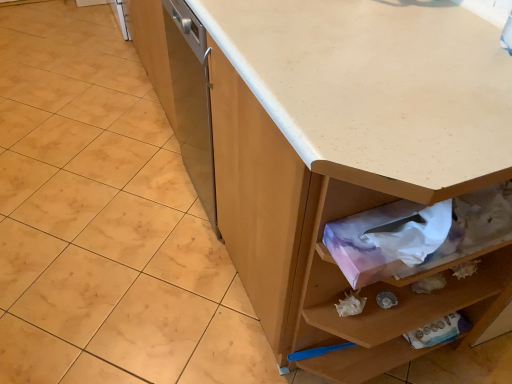
Locate an element on the screen. The width and height of the screenshot is (512, 384). white matte granite at center is located at coordinates (105, 221).

The height and width of the screenshot is (384, 512). Find the location of `pink paper tissue at lower right`. pink paper tissue at lower right is located at coordinates (391, 291).

From a real-world perspective, does pink paper tissue at lower right stand above white matte granite at center?

Indeed, from a real-world perspective, pink paper tissue at lower right stands above white matte granite at center.

Considering the sizes of pink paper tissue at lower right and white matte granite at center in the image, is pink paper tissue at lower right wider or thinner than white matte granite at center?

pink paper tissue at lower right is thinner than white matte granite at center.

From the image's perspective, is pink paper tissue at lower right above or below white matte granite at center?

Clearly, from the image's perspective, pink paper tissue at lower right is below white matte granite at center.

Which is in front, point (38, 256) or point (483, 143)?

The point (483, 143) is more forward.

Consider the image. Between white matte granite at center and white laminate countertop at center, which one has smaller width?

white laminate countertop at center.

Is white matte granite at center looking in the opposite direction of white laminate countertop at center?

white matte granite at center is not turned away from white laminate countertop at center.

Does pink paper tissue at lower right come behind white laminate countertop at center?

Yes, pink paper tissue at lower right is further from the viewer.

Between point (406, 316) and point (438, 199), which one is positioned behind?

Point (406, 316)

Visually, is pink paper tissue at lower right positioned to the left or to the right of white laminate countertop at center?

pink paper tissue at lower right is to the right of white laminate countertop at center.

Based on the photo, are pink paper tissue at lower right and white laminate countertop at center far apart?

That's not correct — pink paper tissue at lower right is a little close to white laminate countertop at center.

Is white laminate countertop at center behind white matte granite at center?

That is False.

Considering the points (262, 70) and (175, 356), which point is in front, point (262, 70) or point (175, 356)?

The point (262, 70) is more forward.

Which of these two, white laminate countertop at center or white matte granite at center, stands shorter?

white matte granite at center.

Could white matte granite at center be considered to be inside white laminate countertop at center?

That's incorrect, white matte granite at center is not inside white laminate countertop at center.

From the image's perspective, which object appears higher, white laminate countertop at center or pink paper tissue at lower right?

white laminate countertop at center is shown above in the image.

Is white laminate countertop at center turned away from pink paper tissue at lower right?

No.

Is white laminate countertop at center in front of or behind pink paper tissue at lower right in the image?

white laminate countertop at center is in front of pink paper tissue at lower right.

Is white laminate countertop at center thinner than pink paper tissue at lower right?

Incorrect, the width of white laminate countertop at center is not less than that of pink paper tissue at lower right.

From the image's perspective, which is above, white matte granite at center or pink paper tissue at lower right?

white matte granite at center.

Between white matte granite at center and pink paper tissue at lower right, which one has more height?

Standing taller between the two is pink paper tissue at lower right.

Looking at this image, which object is positioned more to the left, white matte granite at center or pink paper tissue at lower right?

From the viewer's perspective, white matte granite at center appears more on the left side.

Can you confirm if white matte granite at center is wider than pink paper tissue at lower right?

Indeed, white matte granite at center has a greater width compared to pink paper tissue at lower right.

Locate an element on the screen. The width and height of the screenshot is (512, 384). granite lying above the pink paper tissue at lower right (from the image's perspective) is located at coordinates coord(105,221).

Locate an element on the screen. This screenshot has height=384, width=512. countertop on the right of white matte granite at center is located at coordinates (377, 88).

Based on their spatial positions, is white laminate countertop at center or pink paper tissue at lower right further from white matte granite at center?

Based on the image, white laminate countertop at center appears to be further to white matte granite at center.

Looking at the image, which one is located further to pink paper tissue at lower right, white laminate countertop at center or white matte granite at center?

The object further to pink paper tissue at lower right is white matte granite at center.

From the image, which object appears to be farther from white laminate countertop at center, white matte granite at center or pink paper tissue at lower right?

The object further to white laminate countertop at center is white matte granite at center.

From the image, which object appears to be nearer to pink paper tissue at lower right, white matte granite at center or white laminate countertop at center?

Among the two, white laminate countertop at center is located nearer to pink paper tissue at lower right.

From the image, which object appears to be farther from white laminate countertop at center, pink paper tissue at lower right or white matte granite at center?

white matte granite at center.

Looking at this image, looking at the image, which one is located further to white matte granite at center, pink paper tissue at lower right or white laminate countertop at center?

white laminate countertop at center lies further to white matte granite at center than the other object.

Find the location of a particular element. countertop between white matte granite at center and pink paper tissue at lower right from left to right is located at coordinates (377, 88).